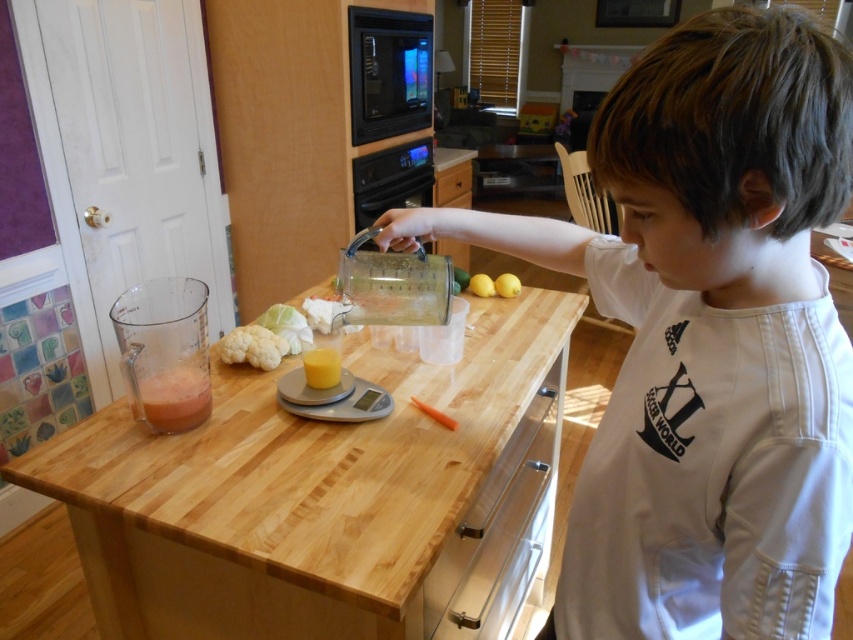
You are a chef observing a young boy in the kitchen. The boy is wearing a white cotton shirt at upper right and using a translucent plastic cup at center. Which item is bigger in size?

The white cotton shirt at upper right has a larger size compared to the translucent plastic cup at center.